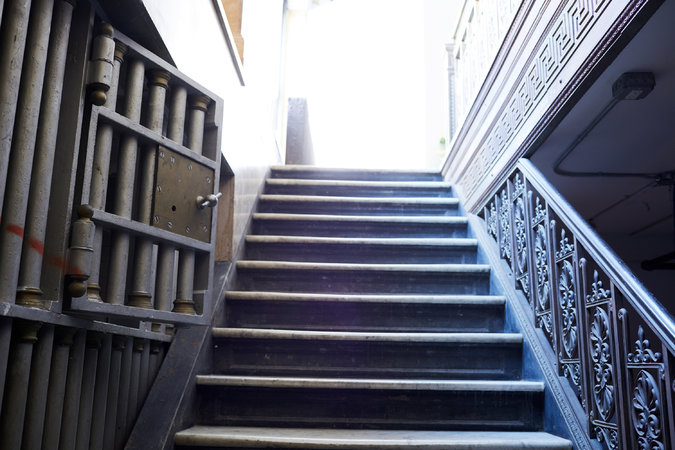
Where is `vertical support posts on handrail`? vertical support posts on handrail is located at coordinates (486, 216), (497, 224), (513, 236), (530, 251), (551, 270), (583, 319), (620, 365), (672, 419).